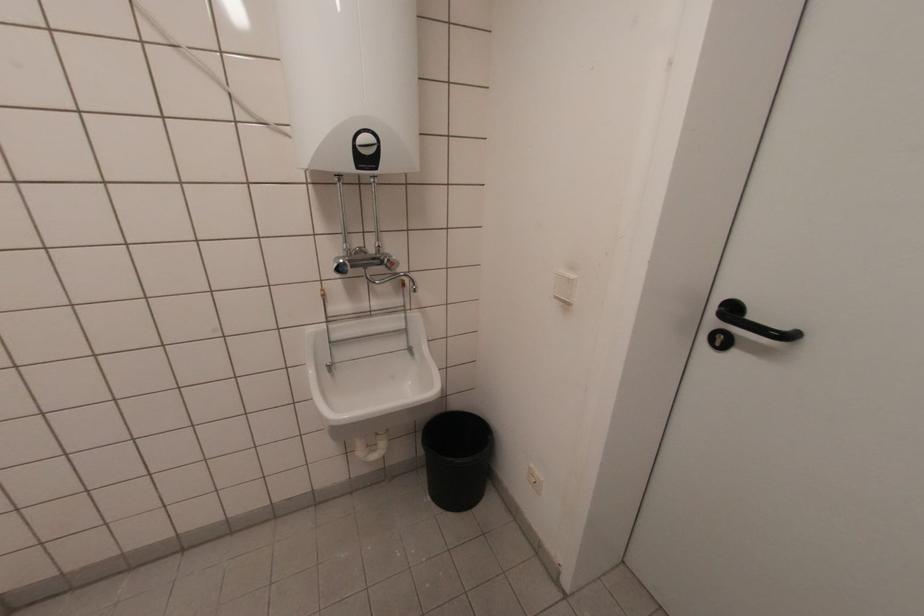
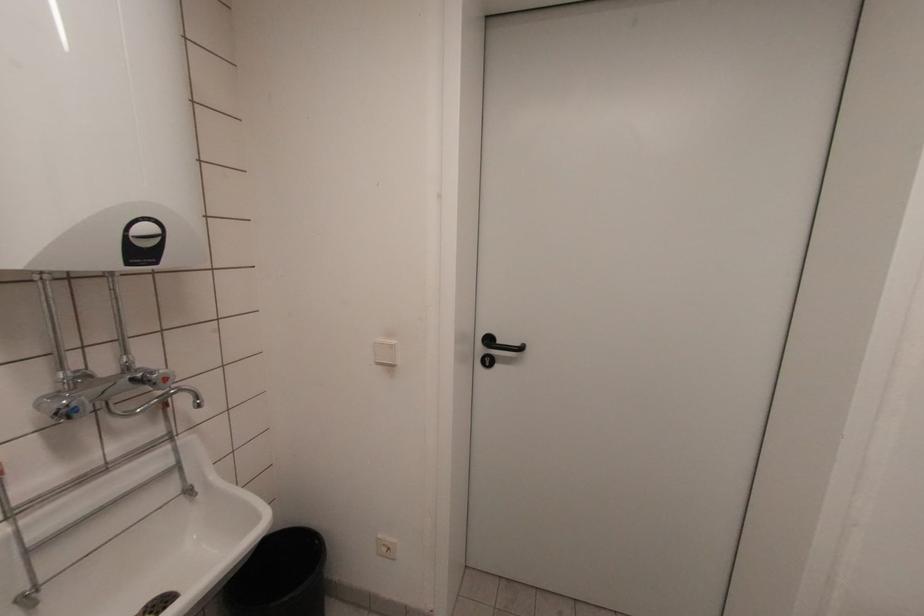
Locate, in the second image, the point that corresponds to point (719, 344) in the first image.

(488, 363)